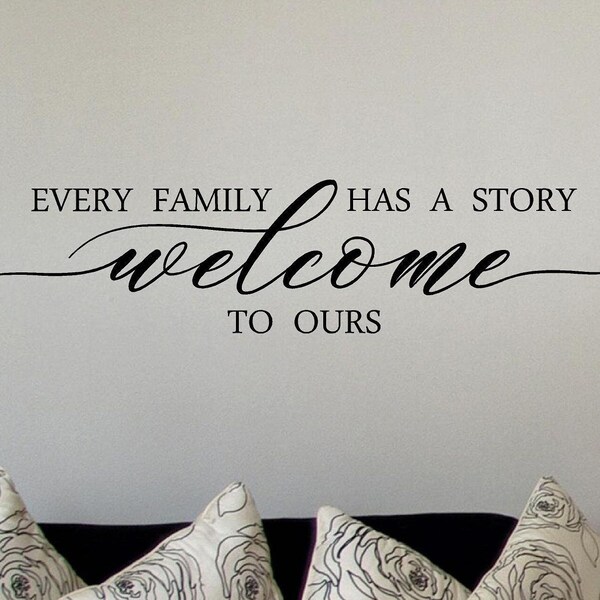
You are a GUI agent. You are given a task and a screenshot of the screen. Output one action in this format:
    pyautogui.click(x=<x>, y=<y>)
    Task: Click on the black sofa
    
    Given the screenshot: What is the action you would take?
    pyautogui.click(x=456, y=542)